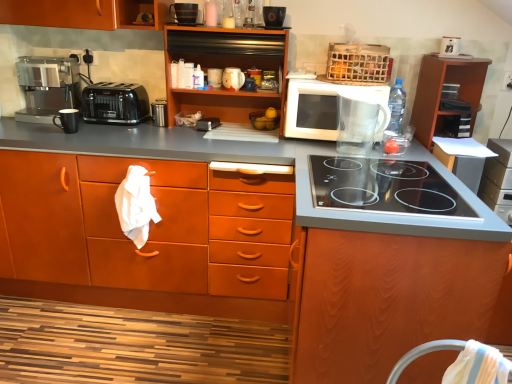
Describe the element at coordinates (321, 107) in the screenshot. I see `white glossy microwave at upper center` at that location.

Image resolution: width=512 pixels, height=384 pixels. Describe the element at coordinates (360, 120) in the screenshot. I see `transparent glass pitcher at center, arranged as the 1th appliance when viewed from the right` at that location.

The width and height of the screenshot is (512, 384). Identify the location of wooden cabinet at right, the 1th cabinetry in the right-to-left sequence. (441, 91).

How much space does wooden cabinet at right, which appears as the fifth cabinetry when viewed from the left, occupy horizontally?

It is 14.77 inches.

Describe the element at coordinates (47, 86) in the screenshot. Image resolution: width=512 pixels, height=384 pixels. I see `stainless steel coffee maker at left` at that location.

The height and width of the screenshot is (384, 512). What do you see at coordinates (214, 77) in the screenshot?
I see `matte white mug at upper center, which appears as the second appliance when viewed from the right` at bounding box center [214, 77].

At what (x,y) coordinates should I click in order to perform the action: click on white glossy microwave at upper center. Please return your answer as a coordinate pair (x, y). The width and height of the screenshot is (512, 384). Looking at the image, I should click on (321, 107).

Is wooden cabinet at right, which appears as the fifth cabinetry when viewed from the left, aimed at white fabric at lower left?

No, wooden cabinet at right, which appears as the fifth cabinetry when viewed from the left, is not oriented towards white fabric at lower left.

Is wooden cabinet at right, the 1th cabinetry in the right-to-left sequence, next to white fabric at lower left and touching it?

wooden cabinet at right, the 1th cabinetry in the right-to-left sequence, and white fabric at lower left are clearly separated.

Which object is positioned more to the right, wooden cabinet at right, which appears as the fifth cabinetry when viewed from the left, or white fabric at lower left?

Positioned to the right is wooden cabinet at right, which appears as the fifth cabinetry when viewed from the left.

Is point (468, 100) closer or farther from the camera than point (157, 217)?

Point (468, 100) is farther from the camera than point (157, 217).

Considering their positions, is stainless steel coffee maker at left located in front of or behind matte white mug at upper center, the 2th appliance viewed from the top?

stainless steel coffee maker at left is positioned closer to the viewer than matte white mug at upper center, the 2th appliance viewed from the top.

Which of these two, stainless steel coffee maker at left or matte white mug at upper center, the 2th appliance viewed from the top, is thinner?

Thinner between the two is matte white mug at upper center, the 2th appliance viewed from the top.

From the stainless steel coffee maker at left, count 2nd appliances backward and point to it. Please provide its 2D coordinates.

[(214, 77)]

Is black glass cooktop at center inside or outside of matte black mug at left, which appears as the 5th appliance when viewed from the right?

The correct answer is: outside.

Is black glass cooktop at center next to matte black mug at left, the second appliance when ordered from bottom to top, and touching it?

No, black glass cooktop at center is not next to matte black mug at left, the second appliance when ordered from bottom to top.

Is black glass cooktop at center facing away from matte black mug at left, marked as the 1th appliance in a left-to-right arrangement?

black glass cooktop at center is not turned away from matte black mug at left, marked as the 1th appliance in a left-to-right arrangement.

Is black glass cooktop at center bigger or smaller than matte black mug at left, the second appliance when ordered from bottom to top?

Clearly, black glass cooktop at center is larger in size than matte black mug at left, the second appliance when ordered from bottom to top.

Locate an element on the screen. gas stove lying above the wooden cabinet at center, which ranks as the 2th cabinetry in right-to-left order (from the image's perspective) is located at coordinates (383, 187).

From a real-world perspective, who is located higher, wooden cabinet at center, which ranks as the 2th cabinetry in right-to-left order, or black glass cooktop at center?

black glass cooktop at center, from a real-world perspective.

Does point (442, 294) lie in front of point (360, 166)?

That is True.

Can you confirm if wooden cabinet at center, which ranks as the 2th cabinetry in right-to-left order, is shorter than black glass cooktop at center?

No, wooden cabinet at center, which ranks as the 2th cabinetry in right-to-left order, is not shorter than black glass cooktop at center.

Is point (60, 128) positioned before point (341, 153)?

That is False.

From the image's perspective, who appears lower, matte black mug at left, which appears as the 5th appliance when viewed from the right, or transparent glass pitcher at center, the 1th appliance positioned from the bottom?

transparent glass pitcher at center, the 1th appliance positioned from the bottom, from the image's perspective.

Is matte black mug at left, marked as the 1th appliance in a left-to-right arrangement, completely or partially outside of transparent glass pitcher at center, arranged as the fifth appliance when viewed from the left?

Yes, matte black mug at left, marked as the 1th appliance in a left-to-right arrangement, is not within transparent glass pitcher at center, arranged as the fifth appliance when viewed from the left.

Considering the relative sizes of matte black mug at left, marked as the 1th appliance in a left-to-right arrangement, and transparent glass pitcher at center, the 1th appliance positioned from the bottom, in the image provided, is matte black mug at left, marked as the 1th appliance in a left-to-right arrangement, bigger than transparent glass pitcher at center, the 1th appliance positioned from the bottom,?

Actually, matte black mug at left, marked as the 1th appliance in a left-to-right arrangement, might be smaller than transparent glass pitcher at center, the 1th appliance positioned from the bottom.

Is matte white mug at upper center, the 2th appliance viewed from the top, placed right next to transparent glass pitcher at center, arranged as the fifth appliance when viewed from the left?

No, matte white mug at upper center, the 2th appliance viewed from the top, is not with transparent glass pitcher at center, arranged as the fifth appliance when viewed from the left.

From a real-world perspective, which object rests below the other?

From a 3D spatial view, transparent glass pitcher at center, arranged as the fifth appliance when viewed from the left, is below.

Is matte white mug at upper center, the fourth appliance viewed from the left, bigger or smaller than transparent glass pitcher at center, the 1th appliance positioned from the bottom?

Clearly, matte white mug at upper center, the fourth appliance viewed from the left, is smaller in size than transparent glass pitcher at center, the 1th appliance positioned from the bottom.

Relative to transparent glass pitcher at center, arranged as the fifth appliance when viewed from the left, is matte white mug at upper center, which appears as the second appliance when viewed from the right, in front or behind?

Clearly, matte white mug at upper center, which appears as the second appliance when viewed from the right, is behind transparent glass pitcher at center, arranged as the fifth appliance when viewed from the left.

From a real-world perspective, which object stands above the other?

matte white mug at upper center, the 2th appliance viewed from the top, from a real-world perspective.

Between white fabric at lower left and matte white mug at upper center, which appears as the second appliance when viewed from the right, which one is positioned in front?

white fabric at lower left is closer to the camera.

Can you confirm if white fabric at lower left is positioned to the right of matte white mug at upper center, which appears as the second appliance when viewed from the right?

No.

This screenshot has width=512, height=384. What are the coordinates of `material that is on the left side of wooden cabinet at right, which appears as the fifth cabinetry when viewed from the left` in the screenshot? It's located at (136, 205).

Where is `appliance that is the 2nd object located behind the stainless steel coffee maker at left`? appliance that is the 2nd object located behind the stainless steel coffee maker at left is located at coordinates (214, 77).

Estimate the real-world distances between objects in this image. Which object is further from matte black toaster at upper left, the fifth appliance from the bottom, white fabric at lower left or white glossy microwave at upper center?

white fabric at lower left.

Which object lies further to the anchor point matte black mug at left, the second appliance when ordered from bottom to top, metallic silver toaster at center, which is the third appliance from top to bottom, or matte white mug at upper center, the fourth appliance viewed from the left?

matte white mug at upper center, the fourth appliance viewed from the left, lies further to matte black mug at left, the second appliance when ordered from bottom to top, than the other object.

Based on their spatial positions, is matte black mug at left, which appears as the 5th appliance when viewed from the right, or white fabric at lower left closer to stainless steel coffee maker at left?

matte black mug at left, which appears as the 5th appliance when viewed from the right, lies closer to stainless steel coffee maker at left than the other object.

Considering their positions, is wooden cabinet at upper center, the third cabinetry viewed from the left, positioned closer to matte white mug at upper center, the fourth appliance when ordered from bottom to top, than matte black toaster at upper left, the 1th appliance when ordered from top to bottom?

Based on the image, wooden cabinet at upper center, the third cabinetry viewed from the left, appears to be nearer to matte white mug at upper center, the fourth appliance when ordered from bottom to top.

When comparing their distances from black plastic toaster at left, does matte white mug at upper center, the 2th appliance viewed from the top, or stainless steel coffee maker at left seem closer?

stainless steel coffee maker at left is closer to black plastic toaster at left.

Estimate the real-world distances between objects in this image. Which object is further from white fabric at lower left, matte black toaster at upper left, the 1th appliance when ordered from top to bottom, or black glass cooktop at center?

black glass cooktop at center is further to white fabric at lower left.

Estimate the real-world distances between objects in this image. Which object is closer to white glossy microwave at upper center, wooden cabinet at right, which appears as the fifth cabinetry when viewed from the left, or wooden cabinet at center, which ranks as the 2th cabinetry in right-to-left order?

wooden cabinet at right, which appears as the fifth cabinetry when viewed from the left.

From the image, which object appears to be farther from black glass cooktop at center, white glossy microwave at upper center or matte white mug at upper center, which appears as the second appliance when viewed from the right?

matte white mug at upper center, which appears as the second appliance when viewed from the right, is further to black glass cooktop at center.

Where is `home appliance that lies between matte black toaster at upper left, the fifth appliance from the bottom, and wooden cabinet at center, the 5th cabinetry when ordered from right to left, from top to bottom`? The image size is (512, 384). home appliance that lies between matte black toaster at upper left, the fifth appliance from the bottom, and wooden cabinet at center, the 5th cabinetry when ordered from right to left, from top to bottom is located at coordinates (47, 86).

This screenshot has height=384, width=512. What are the coordinates of `microwave oven between matte wood cabinets at center, which is counted as the fourth cabinetry, starting from the right, and transparent glass pitcher at center, arranged as the 1th appliance when viewed from the right, in the horizontal direction` in the screenshot? It's located at (321, 107).

I want to click on kitchen appliance between stainless steel coffee maker at left and white fabric at lower left in the vertical direction, so click(115, 103).

You are a GUI agent. You are given a task and a screenshot of the screen. Output one action in this format:
    pyautogui.click(x=<x>, y=<y>)
    Task: Click on the gas stove between matte black toaster at upper left, the 1th appliance when ordered from top to bottom, and white fabric at lower left, in the vertical direction
    This screenshot has height=384, width=512.
    Given the screenshot: What is the action you would take?
    pyautogui.click(x=383, y=187)